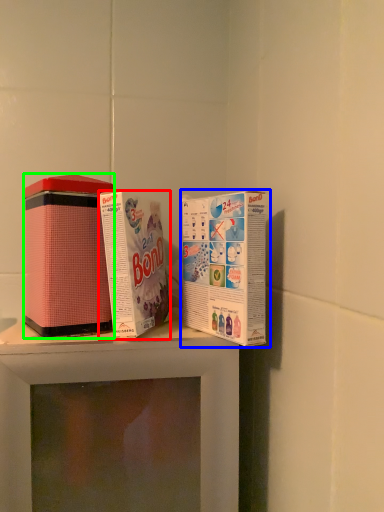
Question: Which object is positioned closest to product (highlighted by a red box)? Select from product (highlighted by a blue box) and product (highlighted by a green box).

Choices:
 (A) product
 (B) product

Answer: (A)